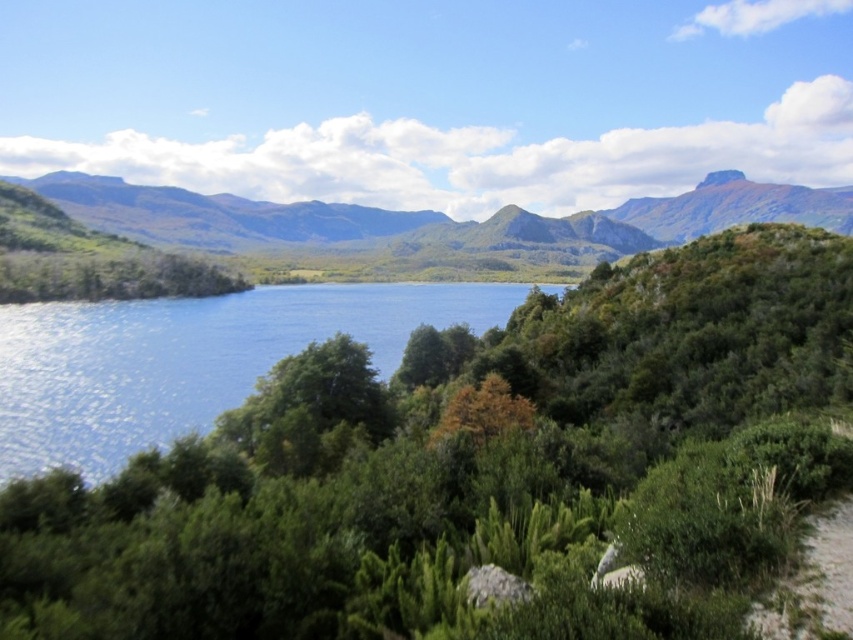
Question: Which point appears closest to the camera in this image?

Choices:
 (A) (750, 625)
 (B) (194, 339)
 (C) (381, 593)

Answer: (A)

Question: Is green leafy tree at center to the right of blue liquid water at center from the viewer's perspective?

Choices:
 (A) yes
 (B) no

Answer: (A)

Question: Which point is closer to the camera?

Choices:
 (A) blue liquid water at center
 (B) green leafy tree at center
 (C) green grass at lower right

Answer: (C)

Question: Estimate the real-world distances between objects in this image. Which object is farther from the blue liquid water at center?

Choices:
 (A) green grass at lower right
 (B) green leafy tree at center
 (C) green leafy mountain at center

Answer: (C)

Question: Is green leafy tree at center positioned behind blue liquid water at center?

Choices:
 (A) no
 (B) yes

Answer: (A)

Question: In this image, where is blue liquid water at center located relative to green leafy mountain at center?

Choices:
 (A) below
 (B) above

Answer: (A)